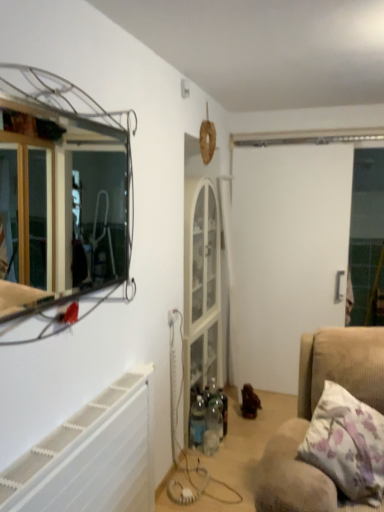
Where is `free spot above white plastic radiator at lower left (from a real-world perspective)`? This screenshot has height=512, width=384. free spot above white plastic radiator at lower left (from a real-world perspective) is located at coordinates 78,424.